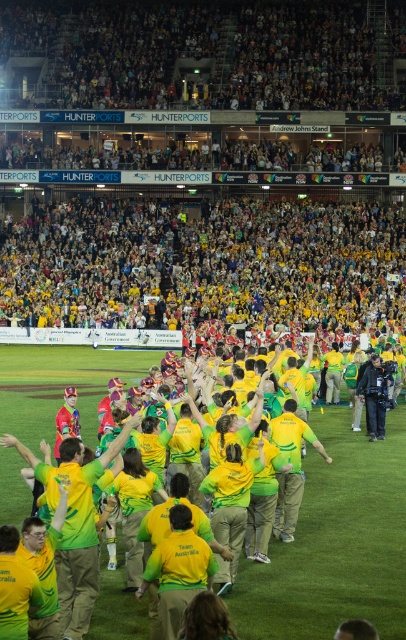
You are a photographer positioned at the edge of the cricket field. You need to capture a photo that includes both the green matte jersey at center and the dark blue jeans at lower right. Based on their positions, which object should you focus on first to ensure both are in the frame?

The green matte jersey at center is located below the dark blue jeans at lower right, so you should focus on the dark blue jeans at lower right first to ensure both are in the frame.

You are a photographer positioned at the edge of the cricket field. You need to capture a photo that includes both the green matte jersey at center and the dark blue jeans at lower right. Based on their positions, which object should you adjust your camera to focus on first to ensure both are in frame?

The green matte jersey at center is to the left of dark blue jeans at lower right, so you should focus on the dark blue jeans at lower right first to ensure both are in frame.